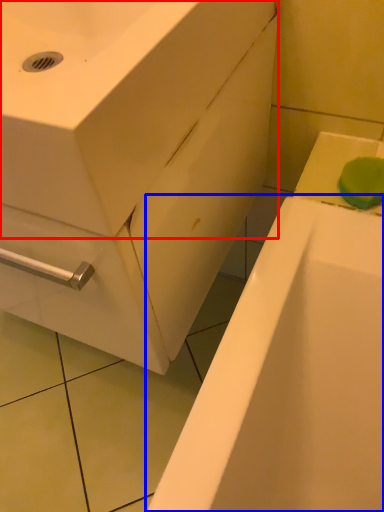
Question: Which of the following is the farthest to the observer, sink (highlighted by a red box) or bathtub (highlighted by a blue box)?

Choices:
 (A) sink
 (B) bathtub

Answer: (B)